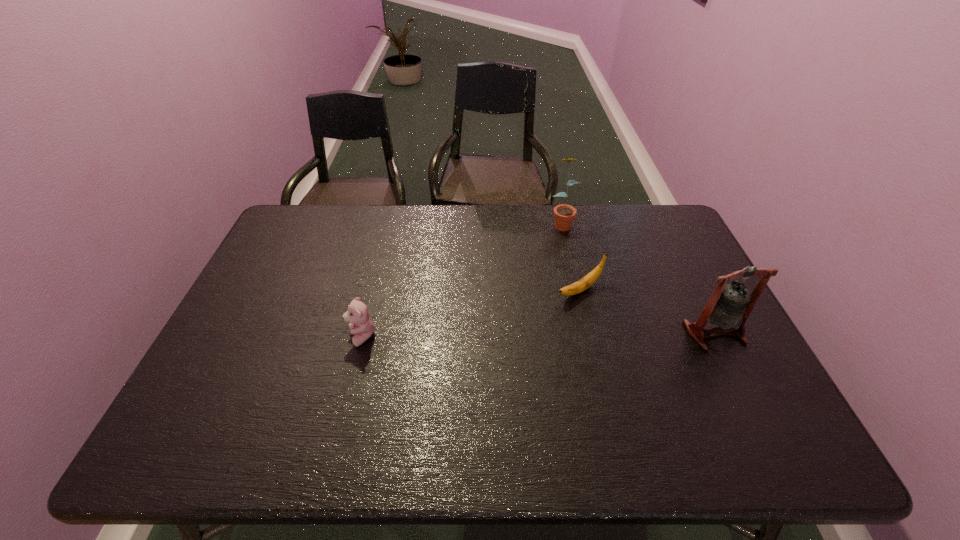
The height and width of the screenshot is (540, 960). I want to click on the second shortest object, so click(x=360, y=324).

Identify the location of the leftmost object. (360, 324).

Image resolution: width=960 pixels, height=540 pixels. In order to click on bell in this screenshot , I will do `click(730, 305)`.

Find the location of a particular element. sunflower is located at coordinates (564, 214).

The height and width of the screenshot is (540, 960). I want to click on the shortest object, so click(584, 283).

The width and height of the screenshot is (960, 540). I want to click on the second farthest object, so click(584, 283).

Locate an element on the screen. The height and width of the screenshot is (540, 960). free space located 0.120m at the face of the third tallest object is located at coordinates (302, 337).

You are a GUI agent. You are given a task and a screenshot of the screen. Output one action in this format:
    pyautogui.click(x=<x>, y=<y>)
    Task: Click on the free space located 0.280m at the face of the third tallest object
    
    Given the screenshot: What is the action you would take?
    pyautogui.click(x=242, y=337)

Where is `blank space located at the face of the third tallest object`? The image size is (960, 540). blank space located at the face of the third tallest object is located at coordinates (302, 337).

You are a GUI agent. You are given a task and a screenshot of the screen. Output one action in this format:
    pyautogui.click(x=<x>, y=<y>)
    Task: Click on the vacant space located on the back of the rightmost object
    
    Given the screenshot: What is the action you would take?
    pyautogui.click(x=680, y=263)